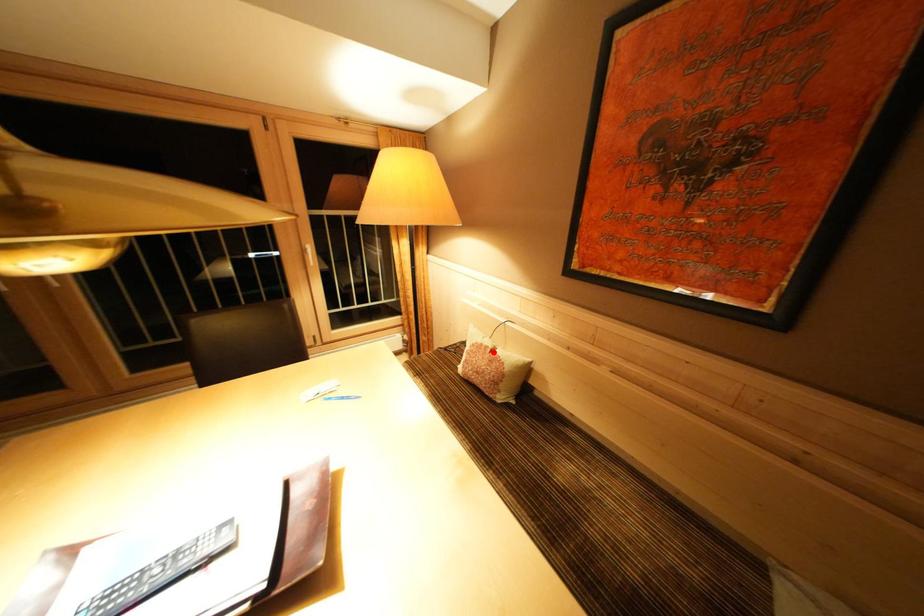
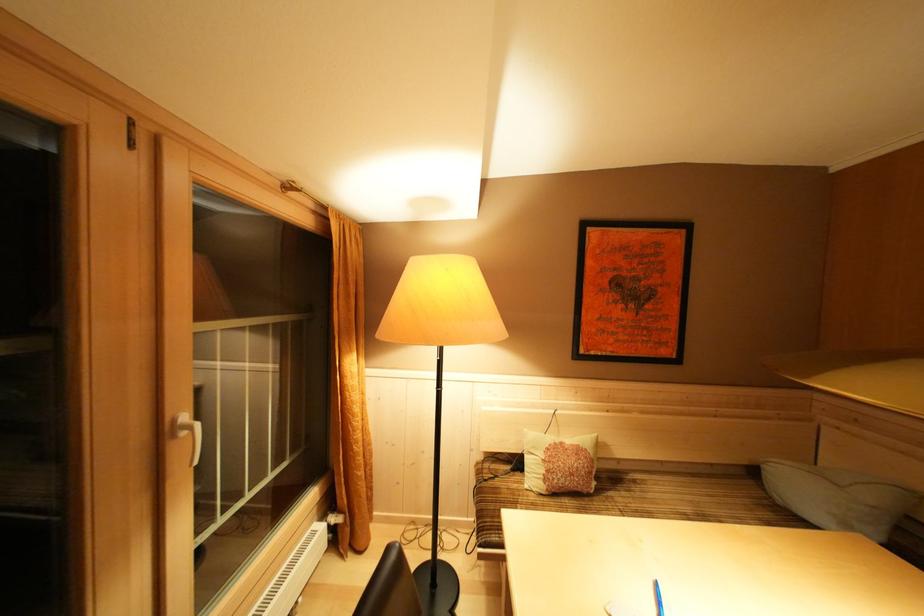
The point at the highlighted location is marked in the first image. Where is the corresponding point in the second image?

(568, 448)